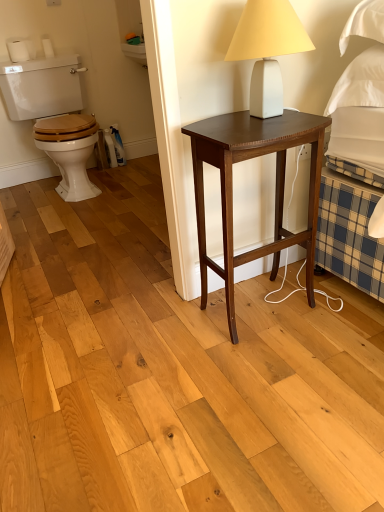
Question: Is dark wood nightstand at center directly adjacent to wooden at left?

Choices:
 (A) no
 (B) yes

Answer: (A)

Question: Is the depth of dark wood nightstand at center greater than that of wooden at left?

Choices:
 (A) no
 (B) yes

Answer: (A)

Question: Considering the relative sizes of dark wood nightstand at center and wooden at left in the image provided, is dark wood nightstand at center thinner than wooden at left?

Choices:
 (A) yes
 (B) no

Answer: (A)

Question: Is wooden at left at the back of dark wood nightstand at center?

Choices:
 (A) yes
 (B) no

Answer: (A)

Question: Could you tell me if dark wood nightstand at center is facing wooden at left?

Choices:
 (A) yes
 (B) no

Answer: (B)

Question: From a real-world perspective, is dark wood nightstand at center on wooden at left?

Choices:
 (A) no
 (B) yes

Answer: (A)

Question: Does dark wood nightstand at center have a smaller size compared to white matte table lamp at upper right?

Choices:
 (A) yes
 (B) no

Answer: (B)

Question: Can you confirm if dark wood nightstand at center is taller than white matte table lamp at upper right?

Choices:
 (A) yes
 (B) no

Answer: (A)

Question: Is dark wood nightstand at center far from white matte table lamp at upper right?

Choices:
 (A) yes
 (B) no

Answer: (B)

Question: From the image's perspective, is dark wood nightstand at center under white matte table lamp at upper right?

Choices:
 (A) no
 (B) yes

Answer: (B)

Question: From a real-world perspective, is dark wood nightstand at center physically below white matte table lamp at upper right?

Choices:
 (A) no
 (B) yes

Answer: (B)

Question: Considering the relative sizes of dark wood nightstand at center and white matte table lamp at upper right in the image provided, is dark wood nightstand at center wider than white matte table lamp at upper right?

Choices:
 (A) yes
 (B) no

Answer: (A)

Question: Is wooden at left outside of dark wood nightstand at center?

Choices:
 (A) yes
 (B) no

Answer: (A)